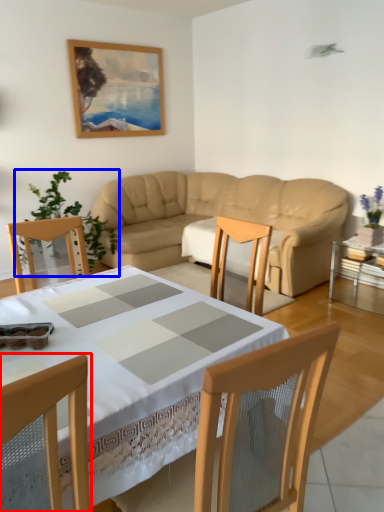
Question: Which object appears closest to the camera in this image, chair (highlighted by a red box) or plant (highlighted by a blue box)?

Choices:
 (A) chair
 (B) plant

Answer: (A)